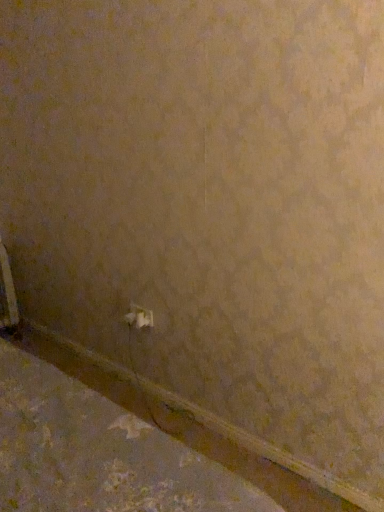
The height and width of the screenshot is (512, 384). Describe the element at coordinates (98, 453) in the screenshot. I see `brown matte concrete at lower left` at that location.

This screenshot has width=384, height=512. What do you see at coordinates (139, 317) in the screenshot?
I see `white plastic power plug at center` at bounding box center [139, 317].

Locate an element on the screen. The height and width of the screenshot is (512, 384). brown matte concrete at lower left is located at coordinates (98, 453).

This screenshot has height=512, width=384. In order to click on concrete in front of the white plastic radiator at lower left in this screenshot , I will do `click(98, 453)`.

Is brown matte concrete at lower left positioned beyond the bounds of white plastic radiator at lower left?

Absolutely, brown matte concrete at lower left is external to white plastic radiator at lower left.

Which point is more distant from viewer, [199,461] or [6,325]?

Positioned behind is point [6,325].

Is brown matte concrete at lower left positioned in front of white plastic radiator at lower left?

Yes, brown matte concrete at lower left is closer to the camera.

Between brown matte concrete at lower left and white plastic power plug at center, which one has smaller size?

With smaller size is white plastic power plug at center.

Is brown matte concrete at lower left shorter than white plastic power plug at center?

Yes.

Could you tell me if brown matte concrete at lower left is facing white plastic power plug at center?

No, brown matte concrete at lower left is not turned towards white plastic power plug at center.

You are a GUI agent. You are given a task and a screenshot of the screen. Output one action in this format:
    pyautogui.click(x=<x>, y=<y>)
    Task: Click on the power plugs and sockets above the brown matte concrete at lower left (from a real-world perspective)
    This screenshot has width=384, height=512.
    Given the screenshot: What is the action you would take?
    pyautogui.click(x=139, y=317)

Between white plastic power plug at center and white plastic radiator at lower left, which one appears on the right side from the viewer's perspective?

white plastic power plug at center is more to the right.

Is white plastic radiator at lower left a part of white plastic power plug at center?

Definitely not — white plastic radiator at lower left is not inside white plastic power plug at center.

Which of these two, white plastic power plug at center or white plastic radiator at lower left, is bigger?

With larger size is white plastic radiator at lower left.

Is the depth of white plastic power plug at center greater than that of white plastic radiator at lower left?

No, white plastic power plug at center is closer to the viewer.

How many degrees apart are the facing directions of white plastic radiator at lower left and white plastic power plug at center?

They differ by 87.1 degrees in their facing directions.

Considering the sizes of objects white plastic radiator at lower left and white plastic power plug at center in the image provided, who is thinner, white plastic radiator at lower left or white plastic power plug at center?

white plastic power plug at center.

From the picture: Considering the sizes of objects white plastic radiator at lower left and white plastic power plug at center in the image provided, who is bigger, white plastic radiator at lower left or white plastic power plug at center?

white plastic radiator at lower left is bigger.

Find the location of a particular element. Image resolution: width=384 pixels, height=512 pixels. radiator above the white plastic power plug at center (from the image's perspective) is located at coordinates (7, 293).

From the image's perspective, would you say white plastic power plug at center is positioned over brown matte concrete at lower left?

Yes, from the image's perspective, white plastic power plug at center is over brown matte concrete at lower left.

Is white plastic power plug at center beside brown matte concrete at lower left?

No.

Can we say white plastic power plug at center lies outside brown matte concrete at lower left?

Indeed, white plastic power plug at center is completely outside brown matte concrete at lower left.

From a real-world perspective, is white plastic power plug at center physically located above or below brown matte concrete at lower left?

white plastic power plug at center is above brown matte concrete at lower left.

Find the location of a particular element. This screenshot has width=384, height=512. concrete below the white plastic radiator at lower left (from the image's perspective) is located at coordinates (98, 453).

Who is taller, white plastic radiator at lower left or brown matte concrete at lower left?

With more height is white plastic radiator at lower left.

From a real-world perspective, is white plastic radiator at lower left over brown matte concrete at lower left?

Indeed, from a real-world perspective, white plastic radiator at lower left stands above brown matte concrete at lower left.

Does white plastic radiator at lower left appear on the right side of brown matte concrete at lower left?

Incorrect, white plastic radiator at lower left is not on the right side of brown matte concrete at lower left.

Identify the location of concrete that appears below the white plastic radiator at lower left (from a real-world perspective). (98, 453).

The height and width of the screenshot is (512, 384). What are the coordinates of `power plugs and sockets above the brown matte concrete at lower left (from the image's perspective)` in the screenshot? It's located at (139, 317).

Consider the image. Based on their spatial positions, is white plastic power plug at center or brown matte concrete at lower left closer to white plastic radiator at lower left?

Among the two, white plastic power plug at center is located nearer to white plastic radiator at lower left.

Looking at the image, which one is located closer to white plastic radiator at lower left, brown matte concrete at lower left or white plastic power plug at center?

The object closer to white plastic radiator at lower left is white plastic power plug at center.

When comparing their distances from white plastic power plug at center, does white plastic radiator at lower left or brown matte concrete at lower left seem further?

Among the two, white plastic radiator at lower left is located further to white plastic power plug at center.

Considering their positions, is white plastic power plug at center positioned further to brown matte concrete at lower left than white plastic radiator at lower left?

The object further to brown matte concrete at lower left is white plastic radiator at lower left.

Considering their positions, is white plastic radiator at lower left positioned closer to brown matte concrete at lower left than white plastic power plug at center?

white plastic power plug at center.

Considering their positions, is brown matte concrete at lower left positioned closer to white plastic power plug at center than white plastic radiator at lower left?

brown matte concrete at lower left lies closer to white plastic power plug at center than the other object.

Locate an element on the screen. power plugs and sockets situated between white plastic radiator at lower left and brown matte concrete at lower left from left to right is located at coordinates (139, 317).